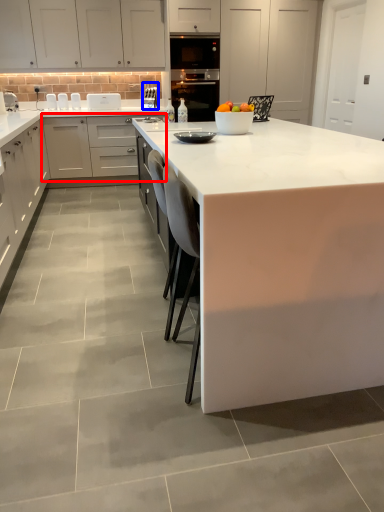
Question: Which of the following is the closest to the observer, cabinetry (highlighted by a red box) or appliance (highlighted by a blue box)?

Choices:
 (A) cabinetry
 (B) appliance

Answer: (A)